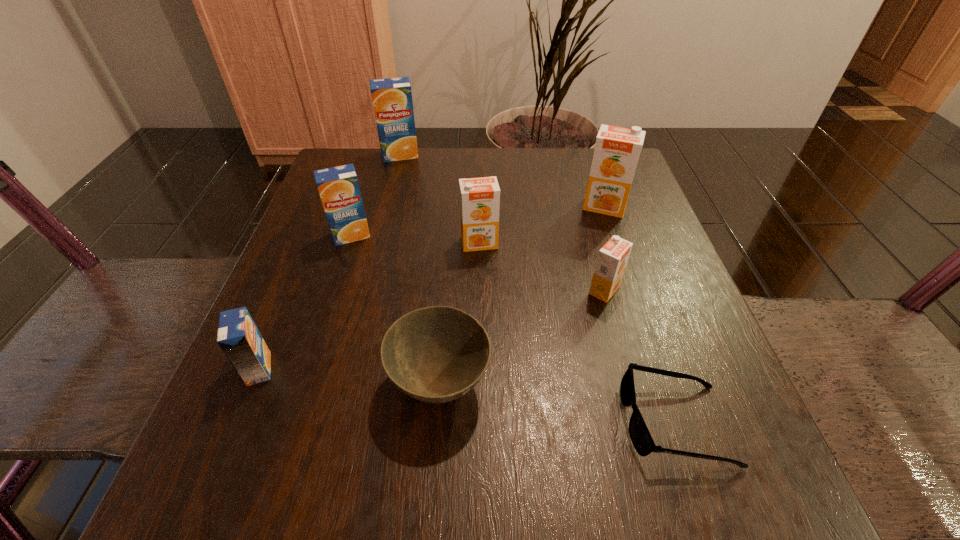
Find the location of a particular element. The image size is (960, 540). blank region between the sunglasses and the farthest blue orange_juice is located at coordinates (538, 288).

You are a GUI agent. You are given a task and a screenshot of the screen. Output one action in this format:
    pyautogui.click(x=<x>, y=<y>)
    Task: Click on the empty location between the leftmost orange orange juice and the fifth farthest orange juice
    
    Given the screenshot: What is the action you would take?
    pyautogui.click(x=541, y=267)

This screenshot has height=540, width=960. I want to click on free area in between the sunglasses and the bowl, so click(558, 403).

Where is `free spot between the fourth orange juice from left to right and the farthest object`? free spot between the fourth orange juice from left to right and the farthest object is located at coordinates (440, 199).

Locate an element on the screen. The image size is (960, 540). object that is the closest to the second shortest object is located at coordinates pos(239,338).

Find the location of `the fourth closest object to the second biggest orange orange juice`. the fourth closest object to the second biggest orange orange juice is located at coordinates (436, 354).

Choose which orange juice is the fourth nearest neighbor to the nearest blue orange_juice. Please provide its 2D coordinates. Your answer should be formatted as a tuple, i.e. [(x, y)], where the tuple contains the x and y coordinates of a point satisfying the conditions above.

[(392, 98)]

Identify which orange juice is the closest to the second smallest blue orange_juice. Please provide its 2D coordinates. Your answer should be formatted as a tuple, i.e. [(x, y)], where the tuple contains the x and y coordinates of a point satisfying the conditions above.

[(479, 197)]

Identify which blue orange_juice is the third nearest to the sunglasses. Please provide its 2D coordinates. Your answer should be formatted as a tuple, i.e. [(x, y)], where the tuple contains the x and y coordinates of a point satisfying the conditions above.

[(392, 98)]

This screenshot has width=960, height=540. What are the coordinates of `the third closest blue orange_juice to the second farthest object` in the screenshot? It's located at (239, 338).